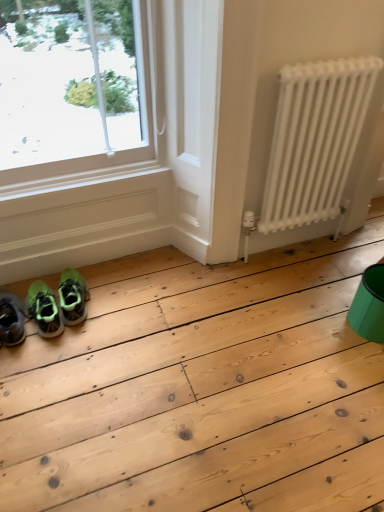
Question: From the image's perspective, is green matte sneakers at lower left located above or below teal plastic bucket at lower right?

Choices:
 (A) above
 (B) below

Answer: (B)

Question: From a real-world perspective, is green matte sneakers at lower left above or below teal plastic bucket at lower right?

Choices:
 (A) above
 (B) below

Answer: (B)

Question: Which object is positioned farthest from the green matte sneakers at lower left?

Choices:
 (A) teal plastic bucket at lower right
 (B) white matte radiator at right
 (C) green matte sneakers at lower left

Answer: (A)

Question: Based on their relative distances, which object is nearer to the teal plastic bucket at lower right?

Choices:
 (A) green matte sneakers at lower left
 (B) green matte sneakers at lower left
 (C) white matte radiator at right

Answer: (C)